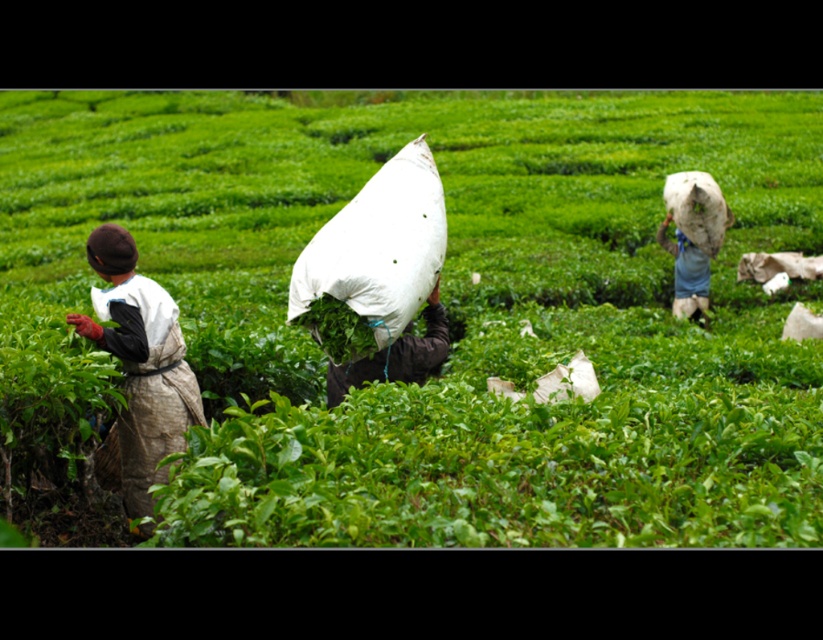
Question: Considering the relative positions of green fabric bag at center and white fabric bag at center in the image provided, where is green fabric bag at center located with respect to white fabric bag at center?

Choices:
 (A) left
 (B) right

Answer: (A)

Question: Is the position of brown fabric apron at left less distant than that of white fabric sack at center?

Choices:
 (A) yes
 (B) no

Answer: (A)

Question: Which point appears farthest from the camera in this image?

Choices:
 (A) (687, 212)
 (B) (401, 225)
 (C) (332, 371)

Answer: (A)

Question: Which object is the farthest from the green fabric bag at center?

Choices:
 (A) white fabric sack at center
 (B) white fabric bag at upper right
 (C) white fabric bag at center

Answer: (B)

Question: Is brown fabric apron at left thinner than white fabric sack at center?

Choices:
 (A) no
 (B) yes

Answer: (B)

Question: Which point is closer to the camera?

Choices:
 (A) (656, 236)
 (B) (333, 387)

Answer: (B)